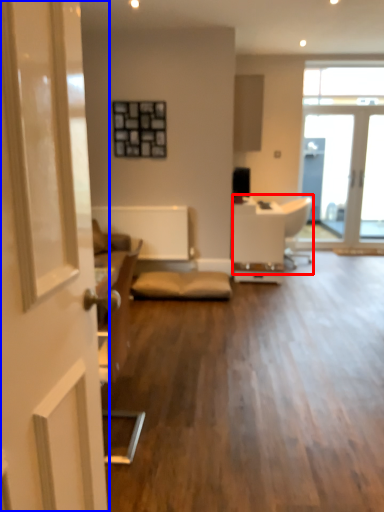
Question: Which point is further to the camera, armchair (highlighted by a red box) or door (highlighted by a blue box)?

Choices:
 (A) armchair
 (B) door

Answer: (A)